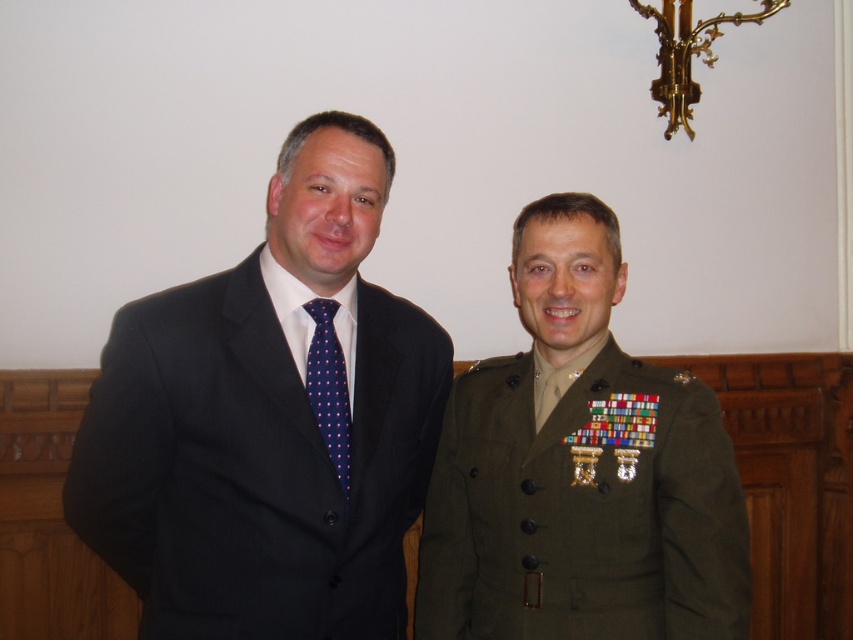
You are a photographer setting up for a group photo. You need to position yourself so that both the matte black suit at left and the green military uniform at right are in focus. Which person should you focus on first to ensure both are sharp?

You should focus on the matte black suit at left first because it is closer to the viewer than the green military uniform at right, so focusing on the closer subject will help ensure both are in focus.

You are a photographer setting up a shoot for two people. The scene requires the person in the matte black suit at left and the person in the green military uniform at right to stand side by side. Based on the image, which person should you position closer to the camera to ensure their full figure is visible without cropping?

The matte black suit at left is wider than the green military uniform at right, so positioning the person in the matte black suit at left closer to the camera will ensure their full width is visible without cropping.

You are a photographer setting up for a group photo. You notice the green military uniform at right and the dark blue dotted tie at center. Which object would require more space in the frame to capture its full width?

The green military uniform at right requires more space in the frame to capture its full width since its width is larger than the dark blue dotted tie at center.